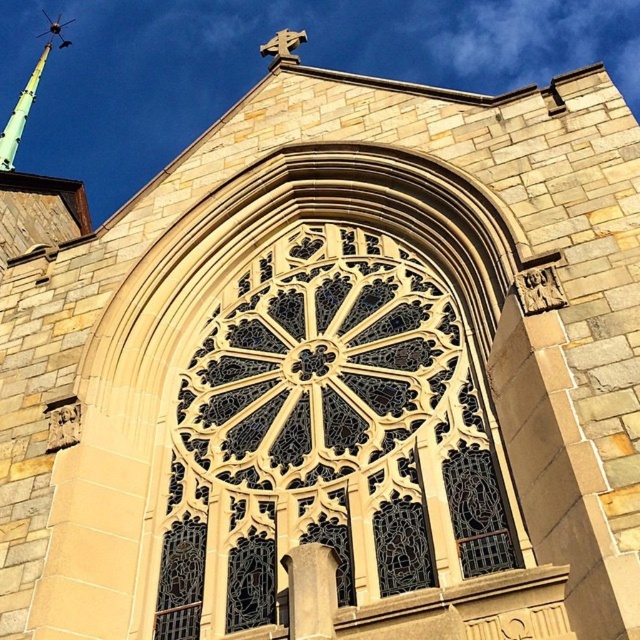
Question: Can you confirm if stained glass window at center is smaller than green glass spire at upper left?

Choices:
 (A) yes
 (B) no

Answer: (A)

Question: Is stained glass window at center thinner than green glass spire at upper left?

Choices:
 (A) yes
 (B) no

Answer: (A)

Question: Which point appears farthest from the camera in this image?

Choices:
 (A) (326, 369)
 (B) (32, 86)

Answer: (B)

Question: Does stained glass window at center appear on the left side of green glass spire at upper left?

Choices:
 (A) no
 (B) yes

Answer: (A)